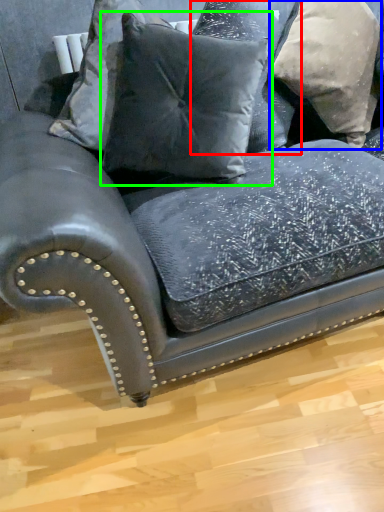
Question: Which is nearer to the pillow (highlighted by a red box)? pillow (highlighted by a blue box) or pillow (highlighted by a green box).

Choices:
 (A) pillow
 (B) pillow

Answer: (A)